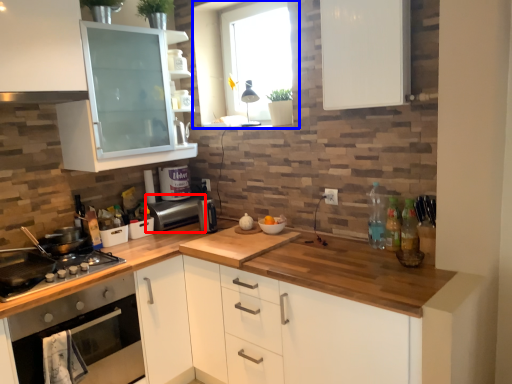
Question: Which object appears farthest to the camera in this image, appliance (highlighted by a red box) or window (highlighted by a blue box)?

Choices:
 (A) appliance
 (B) window

Answer: (A)